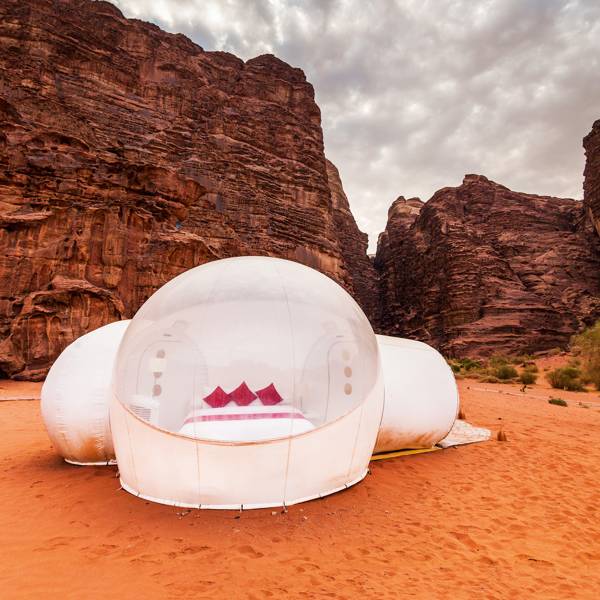
This screenshot has height=600, width=600. Find the location of `red pillows`. red pillows is located at coordinates (217, 394), (238, 394), (268, 395).